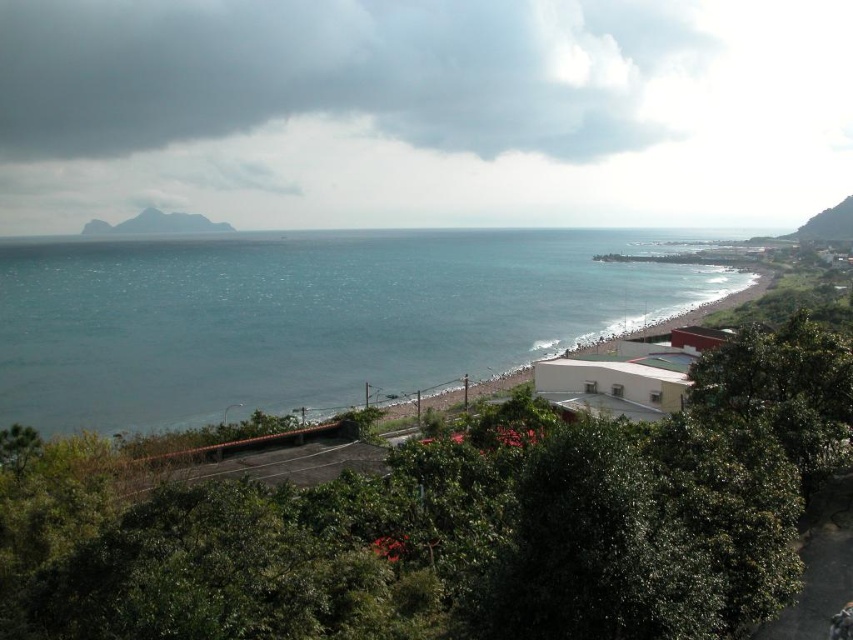
Question: Is blue glossy water at center bigger than green leafy hillside at upper right?

Choices:
 (A) yes
 (B) no

Answer: (A)

Question: Which of the following is the closest to the observer?

Choices:
 (A) green leafy hillside at upper right
 (B) gray rocky mountain at upper left
 (C) blue glossy water at center

Answer: (C)

Question: Among these objects, which one is farthest from the camera?

Choices:
 (A) green leafy hillside at upper right
 (B) gray rocky mountain at upper left
 (C) blue glossy water at center

Answer: (B)

Question: Considering the relative positions of gray rocky mountain at upper left and green leafy hillside at upper right in the image provided, where is gray rocky mountain at upper left located with respect to green leafy hillside at upper right?

Choices:
 (A) right
 (B) left

Answer: (B)

Question: Can you confirm if gray rocky mountain at upper left is wider than green leafy hillside at upper right?

Choices:
 (A) yes
 (B) no

Answer: (A)

Question: Which of the following is the closest to the observer?

Choices:
 (A) (154, 230)
 (B) (848, 234)
 (C) (221, 246)

Answer: (C)